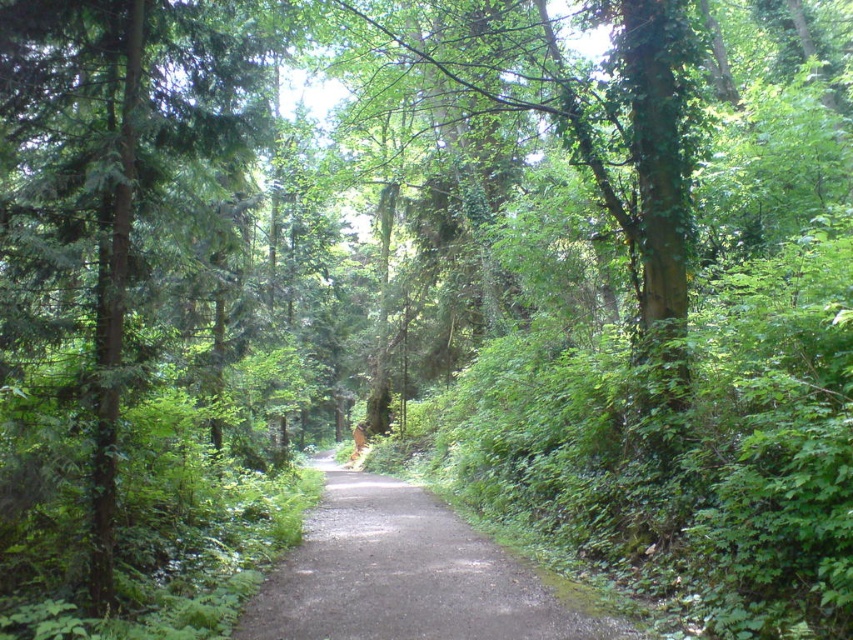
Question: Can you confirm if green matte tree at left is smaller than dull gray asphalt at center?

Choices:
 (A) yes
 (B) no

Answer: (A)

Question: Which object appears farthest from the camera in this image?

Choices:
 (A) green matte tree at left
 (B) dull gray asphalt at center

Answer: (A)

Question: Observing the image, what is the correct spatial positioning of green matte tree at left in reference to dull gray asphalt at center?

Choices:
 (A) above
 (B) below

Answer: (A)

Question: Is green matte tree at left above dull gray asphalt at center?

Choices:
 (A) yes
 (B) no

Answer: (A)

Question: Which point is farther from the camera taking this photo?

Choices:
 (A) (451, 595)
 (B) (61, 147)

Answer: (A)

Question: Which point appears closest to the camera in this image?

Choices:
 (A) (78, 33)
 (B) (321, 502)

Answer: (A)